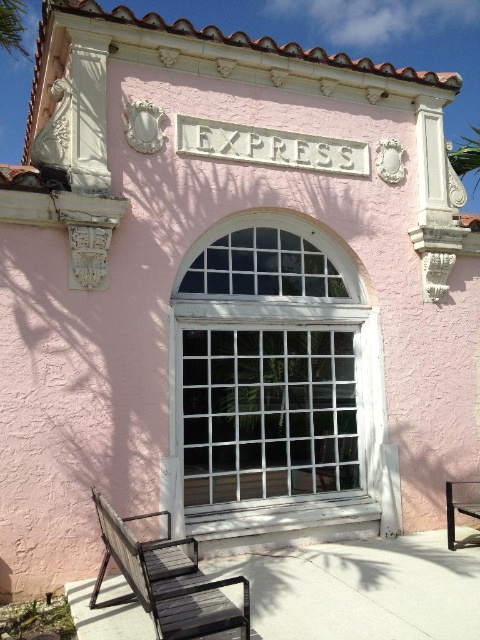
You are a tourist standing in front of the Mediterranean style building. You see a wooden park bench at lower left and a wooden bench at lower right. Which bench is closer to the left side of the building?

The wooden park bench at lower left is closer to the left side of the building because it is positioned to the left of the wooden bench at lower right.

You are sitting on the wooden bench at lower right and want to move to the wooden park bench at lower left. Which direction should you walk to reach it?

The wooden park bench at lower left is located above the wooden bench at lower right, so you should walk upwards to reach it.

You are a tourist standing in front of the Mediterranean style building. You see the wooden park bench at lower left and the wooden bench at lower right. Which bench is closer to you?

The wooden park bench at lower left is closer to you because it is in front of the wooden bench at lower right.